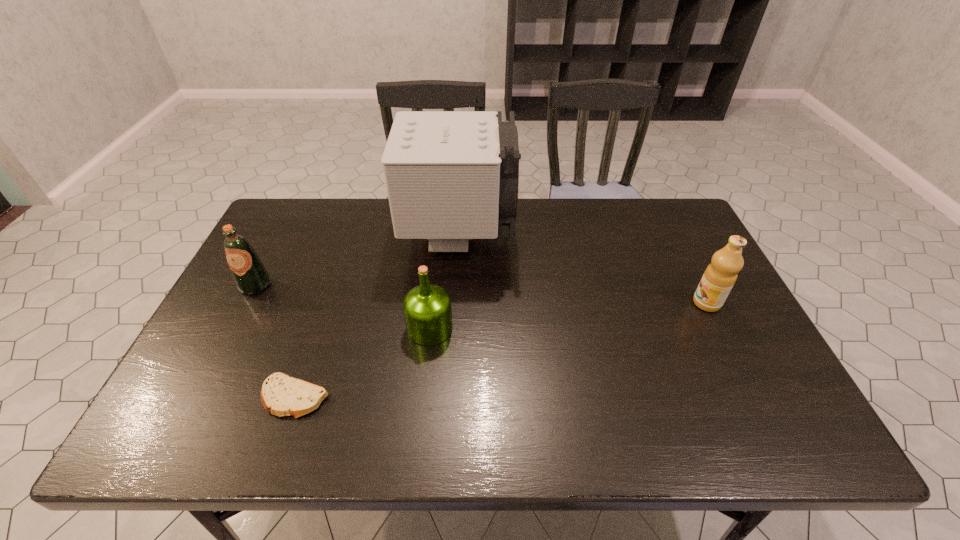
The height and width of the screenshot is (540, 960). I want to click on vacant area in the image that satisfies the following two spatial constraints: 1. on the label of the rightmost olive oil; 2. on the front side of the nearest object, so click(754, 397).